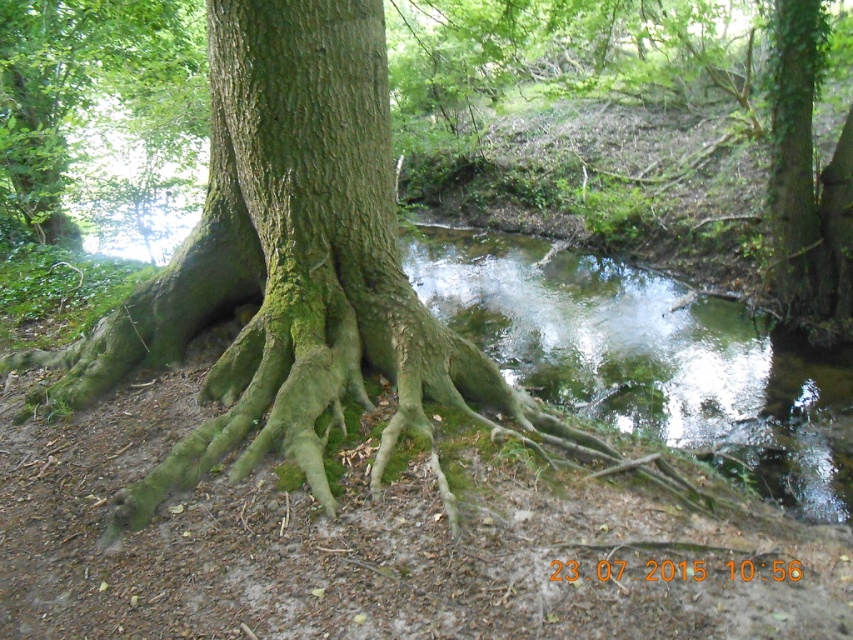
Based on the photo, you are a hiker who wants to cross the stream using the green mossy roots at center. The green mossy water at center is flowing gently. Considering their heights, which one is higher and could potentially be a better stepping stone?

The green mossy roots at center are higher than the green mossy water at center, so they would make a better stepping stone for crossing the stream.

You are standing at the base of the large tree in the scene. You see two points marked on the ground. One is at point (579,266) and the other at point (131,148). If you want to walk towards the point that is further away from you, which point should you head towards?

You should head towards point (579,266) because it is behind point (131,148), meaning it is further away from your current position at the base of the tree.